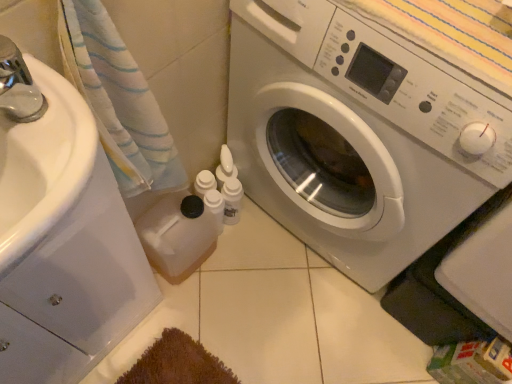
Describe the element at coordinates (359, 134) in the screenshot. The height and width of the screenshot is (384, 512). I see `white glossy washing machine at center` at that location.

Locate an element on the screen. Image resolution: width=512 pixels, height=384 pixels. white glossy drawer at left is located at coordinates (86, 272).

From a real-world perspective, relative to white glossy drawer at left, is white fabric towel at left vertically above or below?

white fabric towel at left is above white glossy drawer at left.

Does white fabric towel at left lie behind white glossy drawer at left?

That is True.

Does white fabric towel at left have a smaller size compared to white glossy drawer at left?

Correct, white fabric towel at left occupies less space than white glossy drawer at left.

Between white fabric towel at left and white glossy drawer at left, which one has less height?

white fabric towel at left is shorter.

Considering the relative sizes of white plastic bottles at center, the 2th toiletry when ordered from right to left, and white plastic bottle at lower center, the 2th toiletry when ordered from left to right, in the image provided, is white plastic bottles at center, the 2th toiletry when ordered from right to left, taller than white plastic bottle at lower center, the 2th toiletry when ordered from left to right,?

In fact, white plastic bottles at center, the 2th toiletry when ordered from right to left, may be shorter than white plastic bottle at lower center, the 2th toiletry when ordered from left to right.

Is white plastic bottles at center, marked as the 1th toiletry in a left-to-right arrangement, wider or thinner than white plastic bottle at lower center, the 2th toiletry when ordered from left to right?

Clearly, white plastic bottles at center, marked as the 1th toiletry in a left-to-right arrangement, has less width compared to white plastic bottle at lower center, the 2th toiletry when ordered from left to right.

Locate an element on the screen. The width and height of the screenshot is (512, 384). toiletry positioned vertically above the white plastic bottle at lower center, arranged as the 1th toiletry when viewed from the right (from a real-world perspective) is located at coordinates (215, 207).

Between point (218, 225) and point (236, 217), which one is positioned behind?

The point (236, 217) is more distant.

Which object is more forward, white plastic bottles at center, marked as the 1th toiletry in a left-to-right arrangement, or white glossy drawer at left?

Positioned in front is white glossy drawer at left.

Is white plastic bottles at center, the 2th toiletry when ordered from right to left, completely or partially outside of white glossy drawer at left?

white plastic bottles at center, the 2th toiletry when ordered from right to left, lies outside white glossy drawer at left's area.

How distant is white plastic bottles at center, marked as the 1th toiletry in a left-to-right arrangement, from white glossy drawer at left?

white plastic bottles at center, marked as the 1th toiletry in a left-to-right arrangement, and white glossy drawer at left are 43.82 centimeters apart.

Considering the relative sizes of white plastic bottles at center, marked as the 1th toiletry in a left-to-right arrangement, and white glossy drawer at left in the image provided, is white plastic bottles at center, marked as the 1th toiletry in a left-to-right arrangement, wider than white glossy drawer at left?

No, white plastic bottles at center, marked as the 1th toiletry in a left-to-right arrangement, is not wider than white glossy drawer at left.

Considering the relative positions of white glossy drawer at left and white fabric towel at left in the image provided, is white glossy drawer at left to the right of white fabric towel at left from the viewer's perspective?

Incorrect, white glossy drawer at left is not on the right side of white fabric towel at left.

Between point (150, 275) and point (163, 140), which one is positioned in front?

The point (163, 140) is in front.

In the scene shown: How different are the orientations of white glossy drawer at left and white fabric towel at left in degrees?

The angular difference between white glossy drawer at left and white fabric towel at left is 1.06 degrees.

Is white glossy drawer at left turned away from white fabric towel at left?

No, white fabric towel at left is not at the back of white glossy drawer at left.

Who is smaller, white glossy washing machine at center or white fabric towel at left?

white fabric towel at left.

What's the angular difference between white glossy washing machine at center and white fabric towel at left's facing directions?

88.1 degrees separate the facing orientations of white glossy washing machine at center and white fabric towel at left.

Is white glossy washing machine at center in front of or behind white fabric towel at left in the image?

Clearly, white glossy washing machine at center is behind white fabric towel at left.

Is white glossy drawer at left looking in the opposite direction of white glossy washing machine at center?

white glossy drawer at left does not have its back to white glossy washing machine at center.

Is white glossy drawer at left far away from white glossy washing machine at center?

Actually, white glossy drawer at left and white glossy washing machine at center are a little close together.

From a real-world perspective, is white glossy drawer at left below white glossy washing machine at center?

Yes, from a real-world perspective, white glossy drawer at left is under white glossy washing machine at center.

Based on the photo, which object is wider, white glossy drawer at left or white glossy washing machine at center?

Wider between the two is white glossy washing machine at center.

Is white glossy washing machine at center oriented away from white plastic bottle at lower center, the 2th toiletry when ordered from left to right?

No, white plastic bottle at lower center, the 2th toiletry when ordered from left to right, is not at the back of white glossy washing machine at center.

Which is behind, point (466, 136) or point (231, 214)?

The point (231, 214) is behind.

Which object is closer to the camera, white glossy washing machine at center or white plastic bottle at lower center, arranged as the 1th toiletry when viewed from the right?

white glossy washing machine at center is closer to the camera.

Which of these two, white glossy washing machine at center or white plastic bottle at lower center, arranged as the 1th toiletry when viewed from the right, is thinner?

white plastic bottle at lower center, arranged as the 1th toiletry when viewed from the right, is thinner.

You are a GUI agent. You are given a task and a screenshot of the screen. Output one action in this format:
    pyautogui.click(x=<x>, y=<y>)
    Task: Click on the bath towel above the white glossy drawer at left (from a real-world perspective)
    
    Given the screenshot: What is the action you would take?
    pyautogui.click(x=118, y=100)

Where is `toiletry below the white plastic bottle at lower center, arranged as the 1th toiletry when viewed from the right (from the image's perspective)`? Image resolution: width=512 pixels, height=384 pixels. toiletry below the white plastic bottle at lower center, arranged as the 1th toiletry when viewed from the right (from the image's perspective) is located at coordinates (215, 207).

Estimate the real-world distances between objects in this image. Which object is further from white glossy washing machine at center, white plastic bottle at lower center, the 2th toiletry when ordered from left to right, or white glossy drawer at left?

Based on the image, white glossy drawer at left appears to be further to white glossy washing machine at center.

Looking at the image, which one is located closer to white plastic bottles at center, marked as the 1th toiletry in a left-to-right arrangement, white fabric towel at left or white glossy washing machine at center?

The object closer to white plastic bottles at center, marked as the 1th toiletry in a left-to-right arrangement, is white glossy washing machine at center.

Looking at the image, which one is located further to white glossy drawer at left, white glossy washing machine at center or white fabric towel at left?

white glossy washing machine at center.

From the image, which object appears to be farther from white fabric towel at left, white glossy drawer at left or white glossy washing machine at center?

Based on the image, white glossy washing machine at center appears to be further to white fabric towel at left.

From the image, which object appears to be nearer to white plastic bottle at lower center, the 2th toiletry when ordered from left to right, white fabric towel at left or white plastic bottles at center, marked as the 1th toiletry in a left-to-right arrangement?

Based on the image, white plastic bottles at center, marked as the 1th toiletry in a left-to-right arrangement, appears to be nearer to white plastic bottle at lower center, the 2th toiletry when ordered from left to right.

Estimate the real-world distances between objects in this image. Which object is further from white fabric towel at left, white plastic bottle at lower center, the 2th toiletry when ordered from left to right, or white plastic bottles at center, marked as the 1th toiletry in a left-to-right arrangement?

white plastic bottle at lower center, the 2th toiletry when ordered from left to right, lies further to white fabric towel at left than the other object.

Considering their positions, is white glossy washing machine at center positioned closer to white plastic bottles at center, marked as the 1th toiletry in a left-to-right arrangement, than white glossy drawer at left?

white glossy drawer at left is closer to white plastic bottles at center, marked as the 1th toiletry in a left-to-right arrangement.

Based on their spatial positions, is white plastic bottle at lower center, the 2th toiletry when ordered from left to right, or white fabric towel at left further from white glossy drawer at left?

white plastic bottle at lower center, the 2th toiletry when ordered from left to right, is further to white glossy drawer at left.

This screenshot has height=384, width=512. Identify the location of bath towel between white glossy drawer at left and white plastic bottles at center, marked as the 1th toiletry in a left-to-right arrangement, along the z-axis. (118, 100).

You are a GUI agent. You are given a task and a screenshot of the screen. Output one action in this format:
    pyautogui.click(x=<x>, y=<y>)
    Task: Click on the toiletry positioned between white glossy washing machine at center and white plastic bottle at lower center, arranged as the 1th toiletry when viewed from the right, from near to far
    The image size is (512, 384).
    Given the screenshot: What is the action you would take?
    pyautogui.click(x=215, y=207)

Image resolution: width=512 pixels, height=384 pixels. In order to click on toiletry positioned between white glossy drawer at left and white plastic bottle at lower center, the 2th toiletry when ordered from left to right, from near to far in this screenshot , I will do `click(215, 207)`.

Identify the location of washing machine between white fabric towel at left and white plastic bottle at lower center, the 2th toiletry when ordered from left to right, in the front-back direction. This screenshot has width=512, height=384. (359, 134).